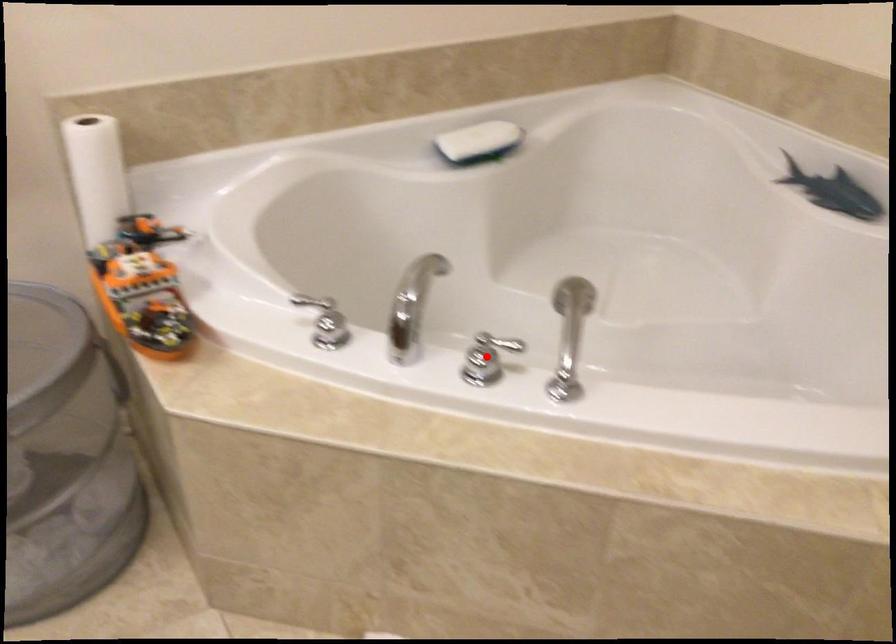
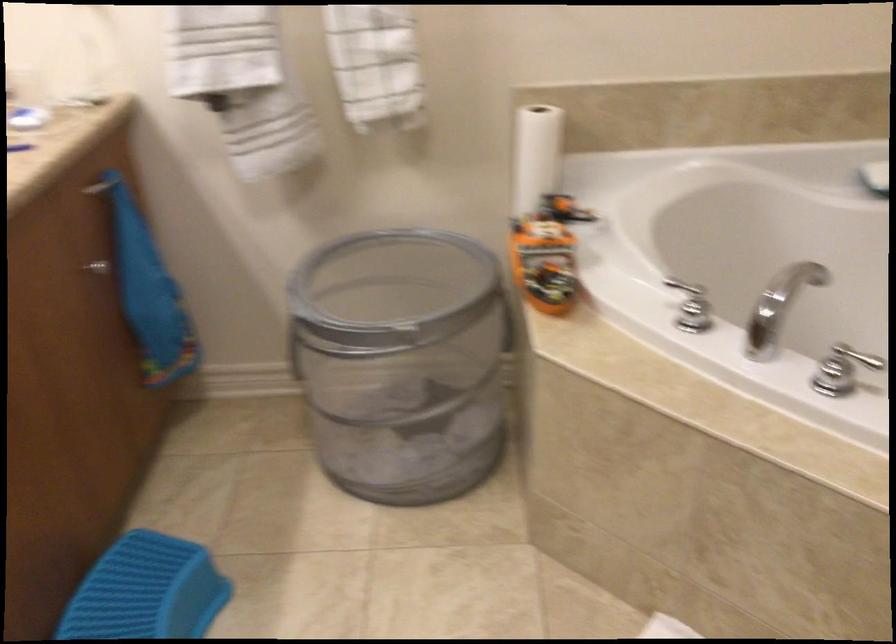
The point at the highlighted location is marked in the first image. Where is the corresponding point in the second image?

(842, 370)